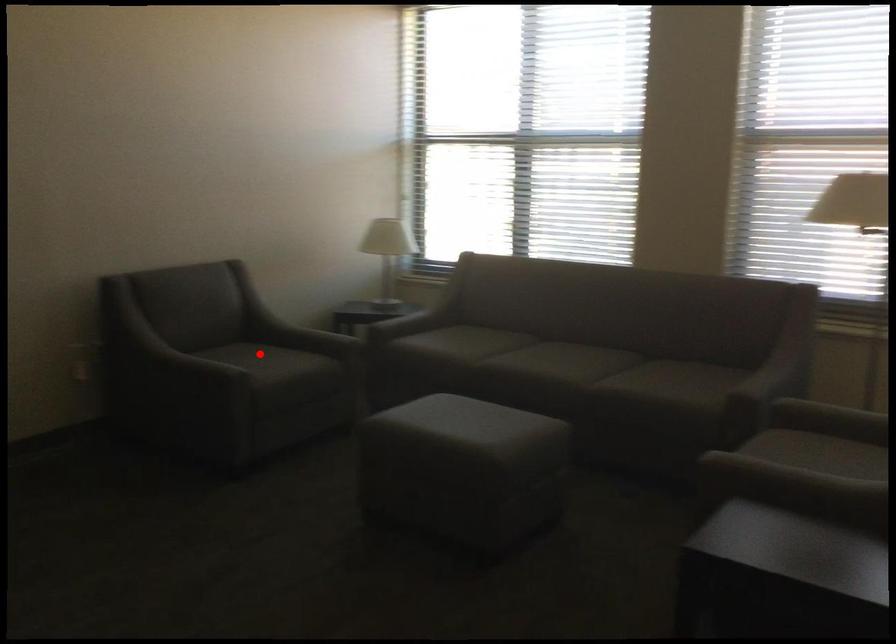
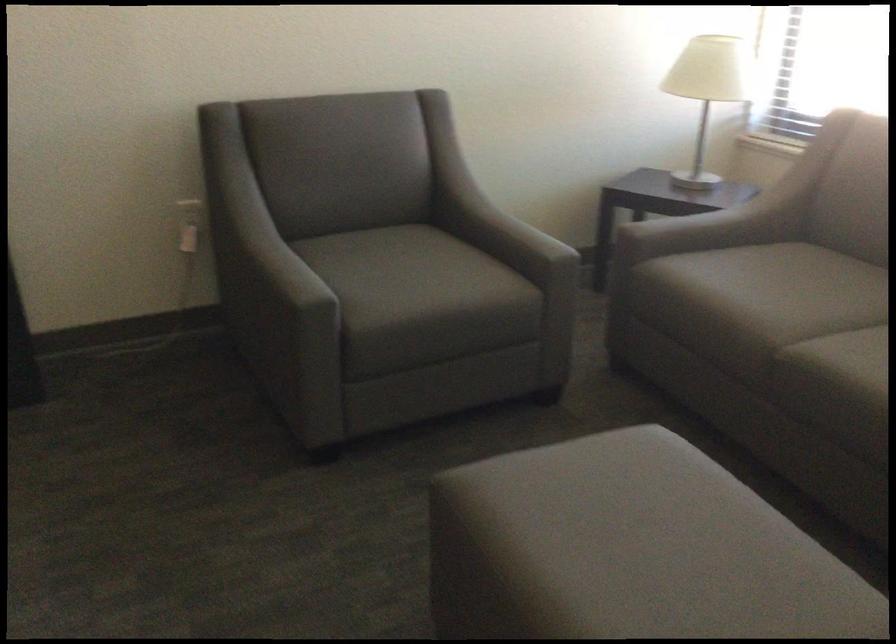
Locate, in the second image, the point that corresponds to the highlighted location in the first image.

(411, 263)